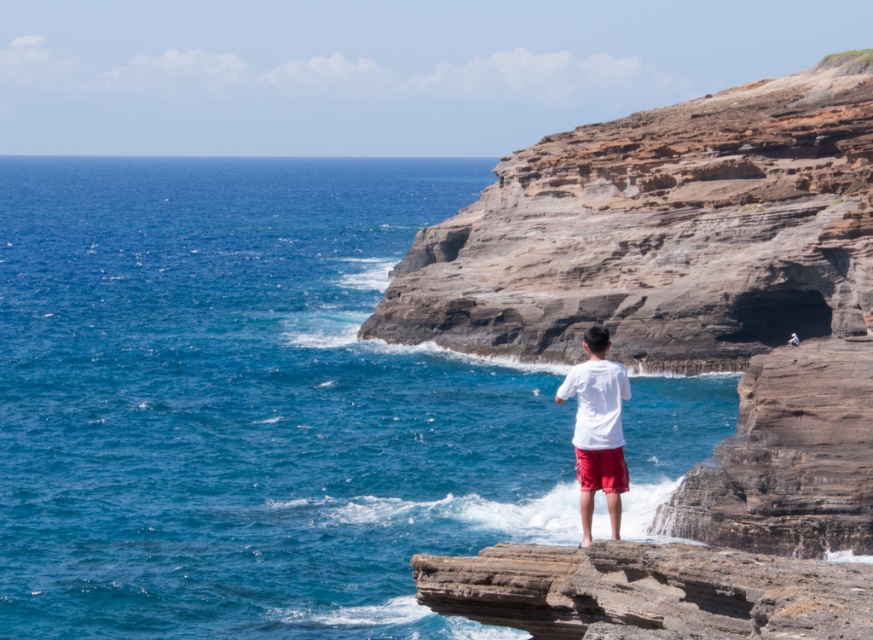
How far apart are blue water at center and red cotton shorts at center?

blue water at center is 186.30 meters away from red cotton shorts at center.

Between blue water at center and red cotton shorts at center, which one is positioned higher?

Positioned higher is blue water at center.

This screenshot has width=873, height=640. Find the location of `blue water at center`. blue water at center is located at coordinates (246, 404).

Where is `blue water at center`? The width and height of the screenshot is (873, 640). blue water at center is located at coordinates (246, 404).

Who is more forward, (x=610, y=452) or (x=596, y=470)?

Point (x=610, y=452) is more forward.

Is white cotton shirt at center wider than red cotton shorts at center?

Yes.

Image resolution: width=873 pixels, height=640 pixels. What do you see at coordinates (597, 428) in the screenshot?
I see `white cotton shirt at center` at bounding box center [597, 428].

Identify the location of white cotton shirt at center. (597, 428).

Can you confirm if blue water at center is positioned below white cotton shirt at center?

No, blue water at center is not below white cotton shirt at center.

Between point (363, 180) and point (605, 472), which one is positioned behind?

The point (363, 180) is more distant.

The width and height of the screenshot is (873, 640). Find the location of `blue water at center`. blue water at center is located at coordinates (246, 404).